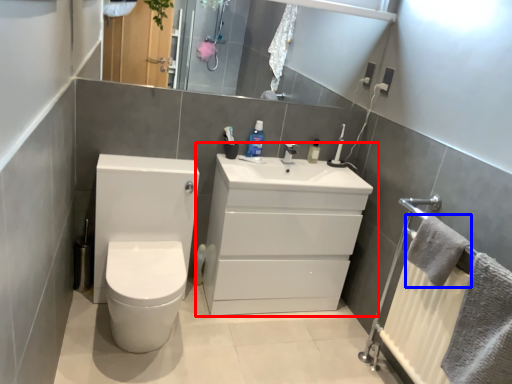
Question: Among these objects, which one is nearest to the camera, bathroom cabinet (highlighted by a red box) or bath towel (highlighted by a blue box)?

Choices:
 (A) bathroom cabinet
 (B) bath towel

Answer: (B)